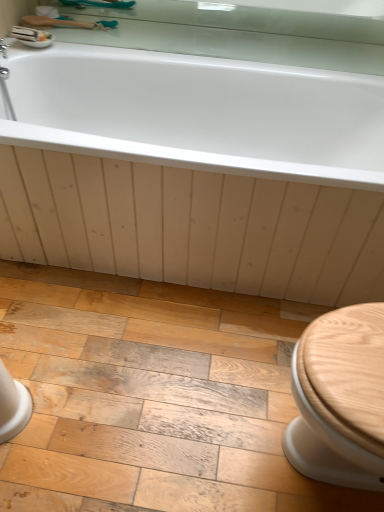
Identify the location of empty space that is ontop of wooden floor at lower center (from a real-world perspective). Image resolution: width=384 pixels, height=512 pixels. (151, 383).